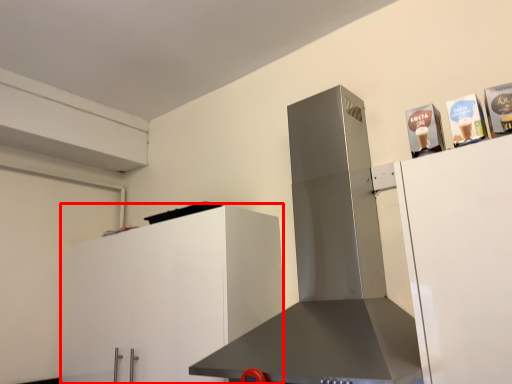
Question: From the image's perspective, considering the relative positions of cabinetry (annotated by the red box) and home appliance in the image provided, where is cabinetry (annotated by the red box) located with respect to the staircase?

Choices:
 (A) above
 (B) below

Answer: (B)